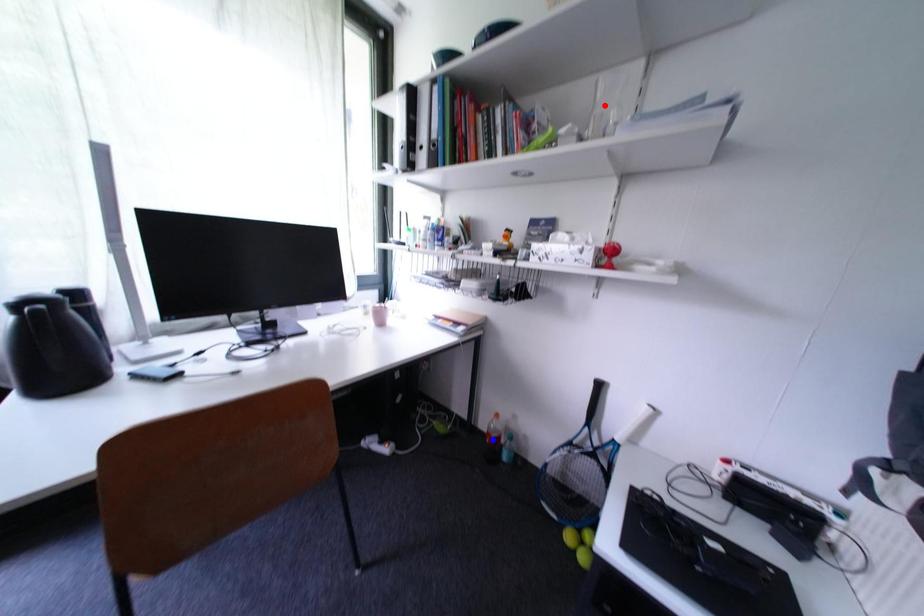
Question: Two points are marked on the image. Which point is closer to the camera?

Choices:
 (A) Blue point is closer.
 (B) Red point is closer.

Answer: (B)